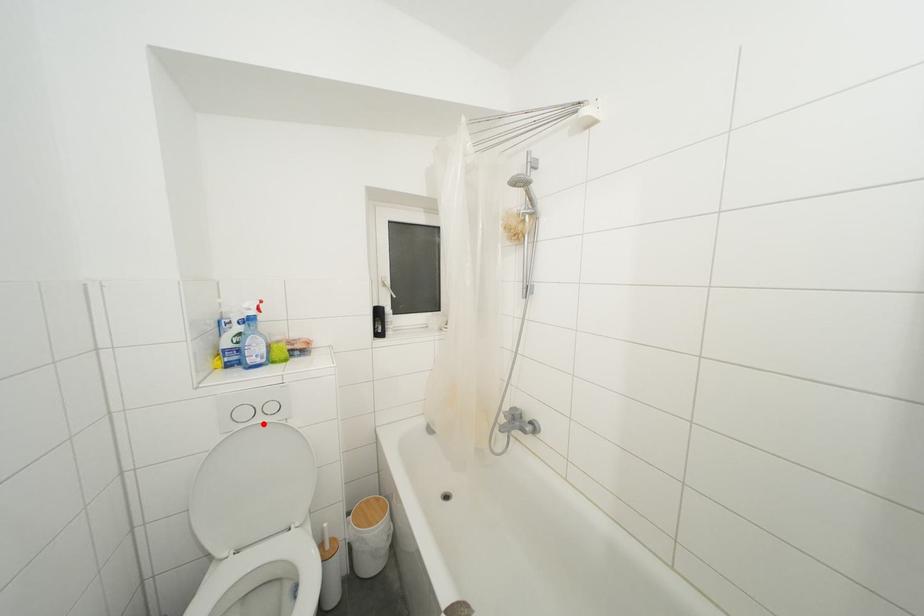
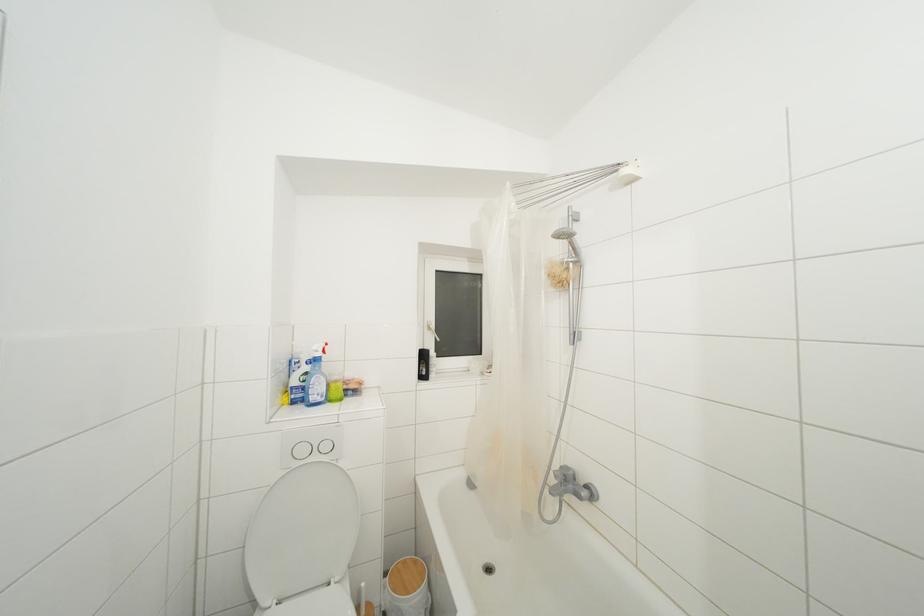
The point at the highlighted location is marked in the first image. Where is the corresponding point in the second image?

(320, 463)